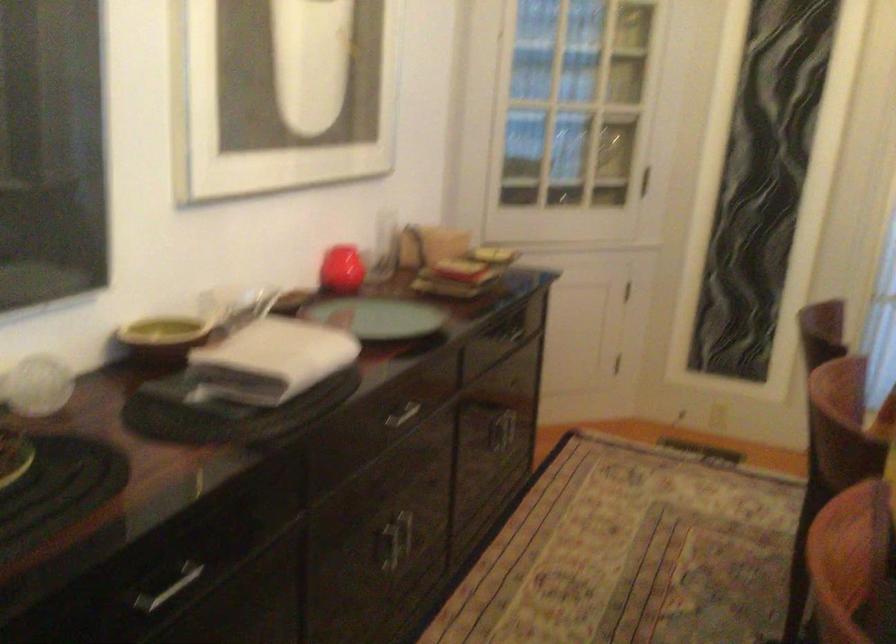
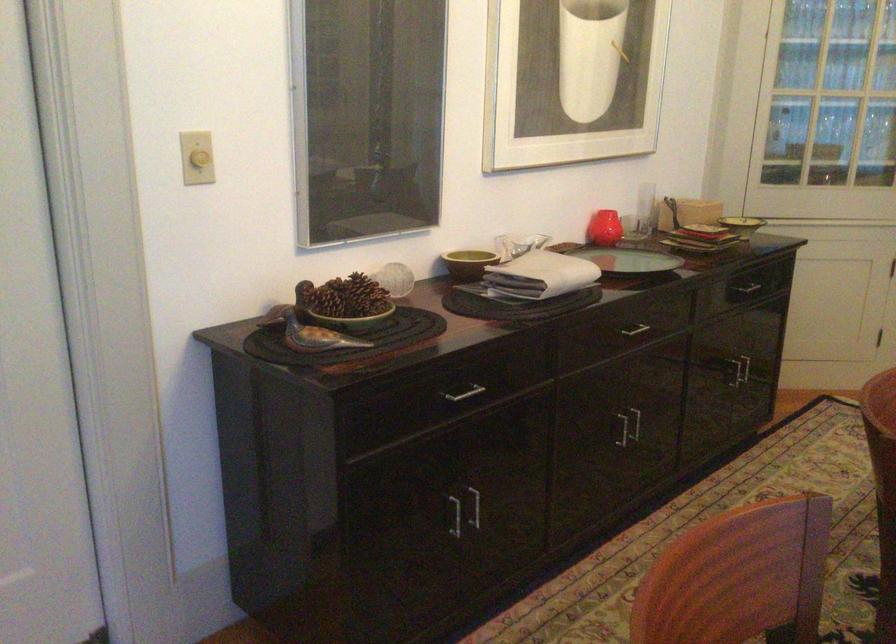
Locate, in the second image, the point that corresponds to point (487, 260) in the first image.

(742, 225)